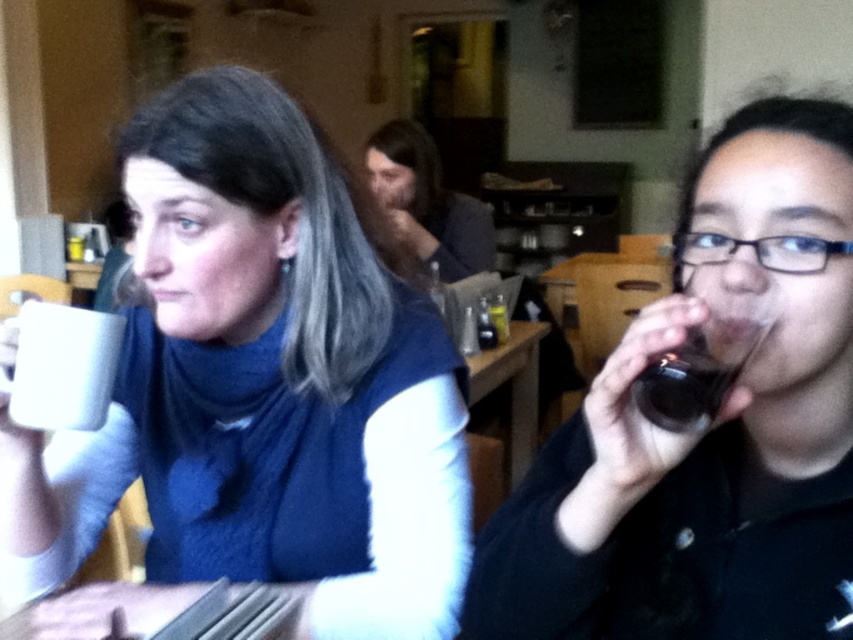
Who is more distant from viewer, [595,394] or [728,364]?

Point [728,364]

This screenshot has height=640, width=853. Describe the element at coordinates (711, 426) in the screenshot. I see `matte black glass at right` at that location.

Where is `matte black glass at right`? The width and height of the screenshot is (853, 640). matte black glass at right is located at coordinates (711, 426).

Can you confirm if dark brown liquid at right is positioned above wooden table at center?

Yes.

You are a GUI agent. You are given a task and a screenshot of the screen. Output one action in this format:
    pyautogui.click(x=<x>, y=<y>)
    Task: Click on the dark brown liquid at right
    The image size is (853, 640).
    Given the screenshot: What is the action you would take?
    [x=683, y=387]

What do you see at coordinates (683, 387) in the screenshot? I see `dark brown liquid at right` at bounding box center [683, 387].

The width and height of the screenshot is (853, 640). Find the location of `dark brown liquid at right`. dark brown liquid at right is located at coordinates (683, 387).

Between point (115, 484) and point (701, 364), which one is positioned behind?

Positioned behind is point (115, 484).

Can you confirm if white matte mug at upper left is positioned to the left of dark brown liquid at right?

Indeed, white matte mug at upper left is positioned on the left side of dark brown liquid at right.

This screenshot has width=853, height=640. What do you see at coordinates (260, 387) in the screenshot? I see `white matte mug at upper left` at bounding box center [260, 387].

Where is `white matte mug at upper left`? The height and width of the screenshot is (640, 853). white matte mug at upper left is located at coordinates (260, 387).